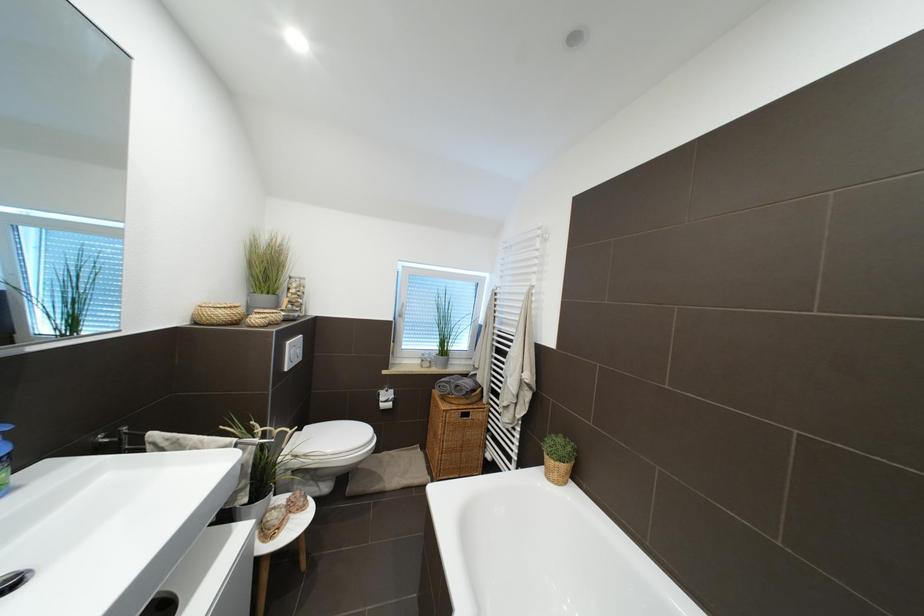
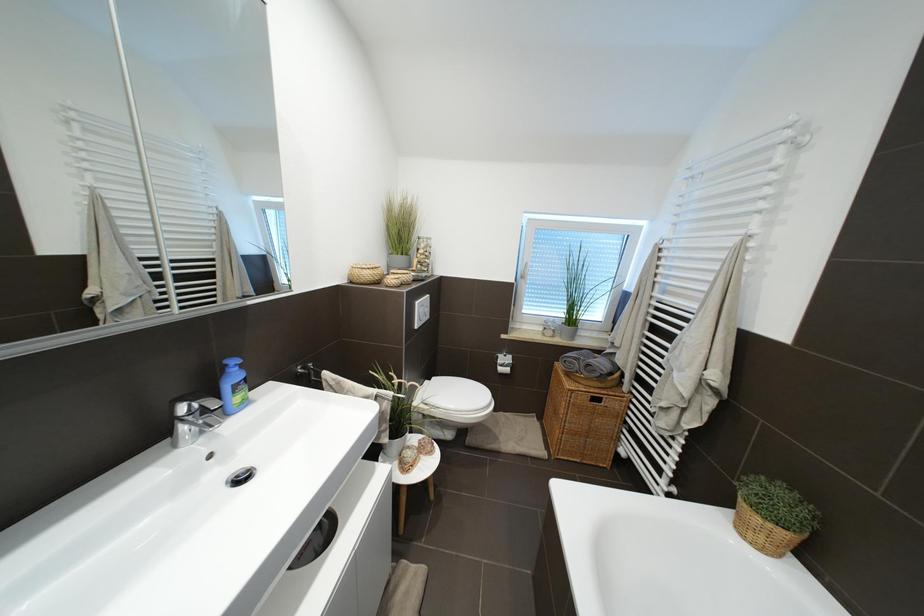
In a continuous first-person perspective shot, in which direction is the camera moving?

The cameraman moved toward left, forward.